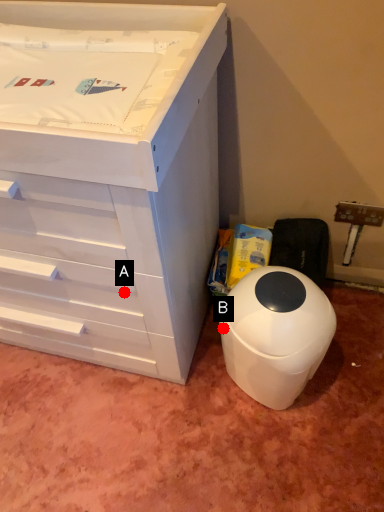
Question: Two points are circled on the image, labeled by A and B beside each circle. Which of the following is the closest to the observer?

Choices:
 (A) A is closer
 (B) B is closer

Answer: (A)